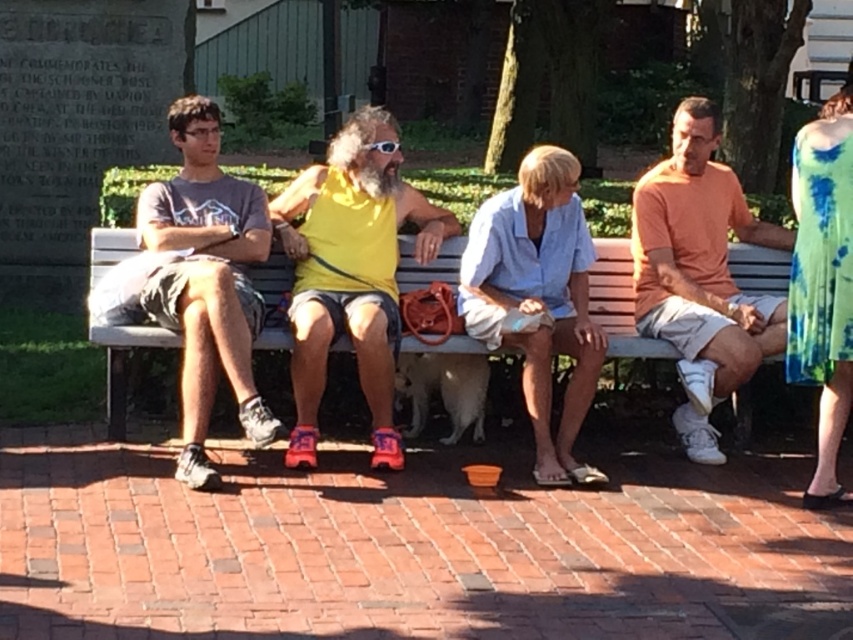
Question: Is yellow matte tank top at center to the right of wooden bench at center from the viewer's perspective?

Choices:
 (A) yes
 (B) no

Answer: (B)

Question: Which object is positioned closest to the matte gray t-shirt at left?

Choices:
 (A) orange cotton shirt at right
 (B) wooden bench at center

Answer: (B)

Question: Which object is positioned farthest from the matte gray t-shirt at left?

Choices:
 (A) wooden bench at center
 (B) orange cotton shirt at right
 (C) yellow matte tank top at center

Answer: (B)

Question: Which point is closer to the camera taking this photo?

Choices:
 (A) (115, 388)
 (B) (134, 282)
 (C) (662, 225)

Answer: (B)

Question: Can you confirm if matte gray t-shirt at left is positioned to the left of wooden bench at center?

Choices:
 (A) no
 (B) yes

Answer: (B)

Question: Can you confirm if matte gray t-shirt at left is smaller than wooden bench at center?

Choices:
 (A) no
 (B) yes

Answer: (A)